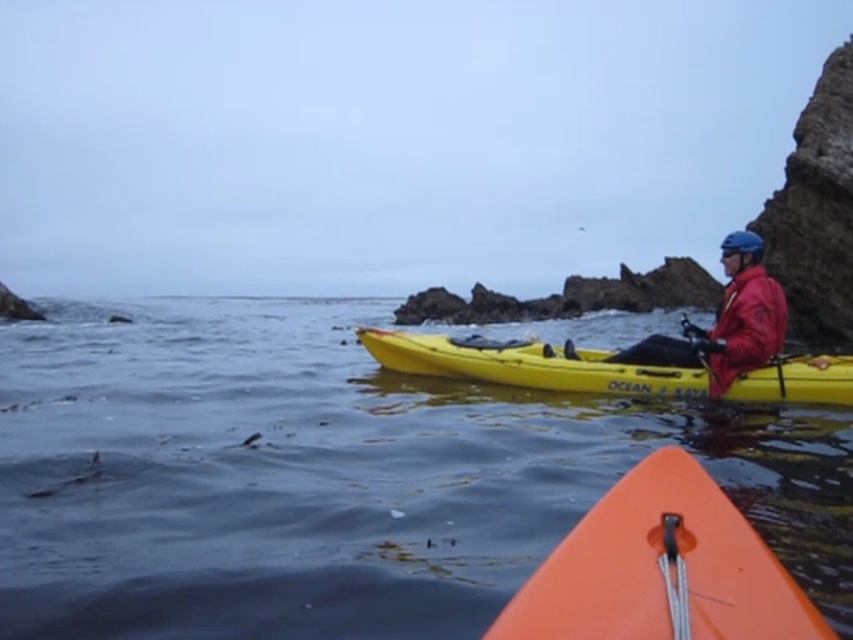
Question: Can you confirm if red matte jacket at right is wider than red matte life jacket at right?

Choices:
 (A) yes
 (B) no

Answer: (A)

Question: Which object is the farthest from the red matte life jacket at right?

Choices:
 (A) red matte jacket at right
 (B) yellow matte kayak at center
 (C) orange matte kayak at lower center

Answer: (C)

Question: Which point appears farthest from the camera in this image?

Choices:
 (A) (502, 460)
 (B) (579, 557)
 (C) (587, 365)

Answer: (C)

Question: Does yellow matte kayak at center lie in front of red matte life jacket at right?

Choices:
 (A) no
 (B) yes

Answer: (B)

Question: Is red matte jacket at right smaller than red matte life jacket at right?

Choices:
 (A) no
 (B) yes

Answer: (A)

Question: Estimate the real-world distances between objects in this image. Which object is farther from the red matte jacket at right?

Choices:
 (A) orange matte kayak at lower center
 (B) red matte life jacket at right
 (C) yellow matte kayak at center
 (D) clear water at center

Answer: (D)